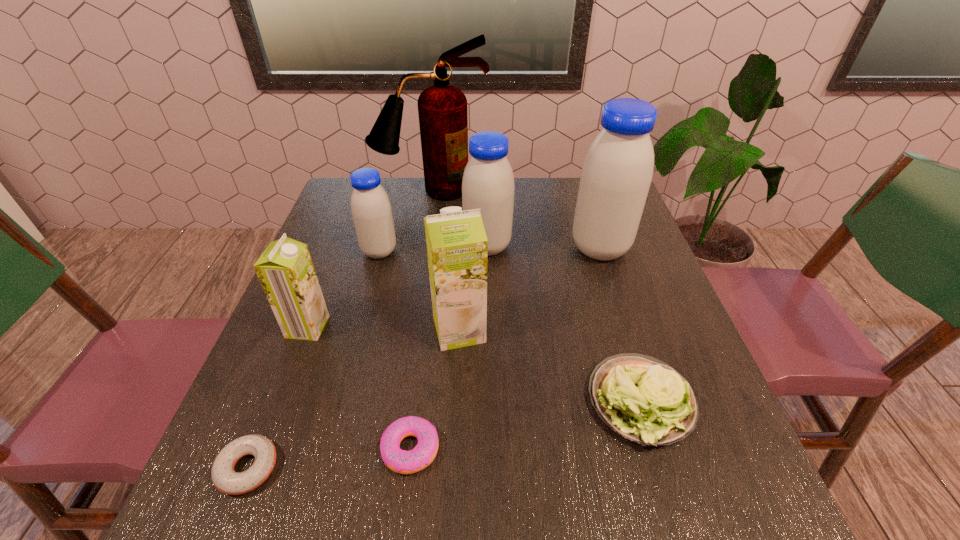
Image resolution: width=960 pixels, height=540 pixels. Identify the location of free location that satisfies the following two spatial constraints: 1. at the nozzle of the farthest object; 2. on the right side of the seventh tallest object. (397, 402).

Identify the location of free location that satisfies the following two spatial constraints: 1. on the front side of the bigger green soya milk; 2. on the left side of the third shortest object. The width and height of the screenshot is (960, 540). (456, 402).

The image size is (960, 540). In order to click on vacant point that satisfies the following two spatial constraints: 1. on the front side of the leftmost blue soya milk; 2. on the left side of the lettuce in this screenshot , I will do `click(339, 402)`.

You are a GUI agent. You are given a task and a screenshot of the screen. Output one action in this format:
    pyautogui.click(x=<x>, y=<y>)
    Task: Click on the vacant space that satisfies the following two spatial constraints: 1. at the nozzle of the red fire extinguisher; 2. on the right side of the pink doughnut
    The width and height of the screenshot is (960, 540).
    Given the screenshot: What is the action you would take?
    tap(391, 449)